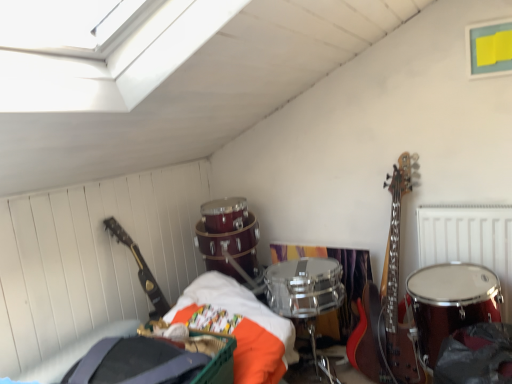
Image resolution: width=512 pixels, height=384 pixels. Find the location of `metallic silver radiator at upper right`. metallic silver radiator at upper right is located at coordinates (469, 240).

Is metallic silver radiator at upper right positioned with its back to glossy black guitar at left?

No, metallic silver radiator at upper right is not facing away from glossy black guitar at left.

Locate an element on the screen. guitar located above the metallic silver radiator at upper right (from a real-world perspective) is located at coordinates (140, 270).

In the scene shown: Can you confirm if metallic silver radiator at upper right is shorter than glossy black guitar at left?

Correct, metallic silver radiator at upper right is not as tall as glossy black guitar at left.

How many degrees apart are the facing directions of shiny red drum at right and glossy black guitar at left?

The angle between the facing direction of shiny red drum at right and the facing direction of glossy black guitar at left is 87.6 degrees.

Looking at their sizes, would you say shiny red drum at right is wider or thinner than glossy black guitar at left?

In the image, shiny red drum at right appears to be wider than glossy black guitar at left.

Considering the sizes of objects shiny red drum at right and glossy black guitar at left in the image provided, who is bigger, shiny red drum at right or glossy black guitar at left?

Bigger between the two is shiny red drum at right.

From the image's perspective, which is below, shiny red drum at right or glossy black guitar at left?

shiny red drum at right is shown below in the image.

From a real-world perspective, is shiny red drum at right on top of metallic silver radiator at upper right?

No, from a real-world perspective, shiny red drum at right is not above metallic silver radiator at upper right.

Based on the photo, from their relative heights in the image, would you say shiny red drum at right is taller or shorter than metallic silver radiator at upper right?

Clearly, shiny red drum at right is shorter compared to metallic silver radiator at upper right.

Based on their sizes in the image, would you say shiny red drum at right is bigger or smaller than metallic silver radiator at upper right?

Clearly, shiny red drum at right is larger in size than metallic silver radiator at upper right.

Is shiny red drum at right completely or partially outside of metallic silver radiator at upper right?

Absolutely, shiny red drum at right is external to metallic silver radiator at upper right.

Between metallic silver radiator at upper right and shiny red drum at right, which one has less height?

shiny red drum at right is shorter.

Does metallic silver radiator at upper right have a greater width compared to shiny red drum at right?

In fact, metallic silver radiator at upper right might be narrower than shiny red drum at right.

Between metallic silver radiator at upper right and shiny red drum at right, which one appears on the right side from the viewer's perspective?

Positioned to the right is metallic silver radiator at upper right.

From the image's perspective, who appears lower, metallic silver radiator at upper right or shiny red drum at right?

From the image's view, shiny red drum at right is below.

Is glossy black guitar at left facing towards shiny red drum at right?

No, glossy black guitar at left does not turn towards shiny red drum at right.

Considering the positions of objects glossy black guitar at left and shiny red drum at right in the image provided, who is more to the left, glossy black guitar at left or shiny red drum at right?

Positioned to the left is glossy black guitar at left.

Is glossy black guitar at left far away from shiny red drum at right?

Yes, glossy black guitar at left and shiny red drum at right are quite far apart.

Which of these two, glossy black guitar at left or shiny red drum at right, is wider?

With larger width is shiny red drum at right.

Between glossy black guitar at left and metallic silver radiator at upper right, which one appears on the right side from the viewer's perspective?

From the viewer's perspective, metallic silver radiator at upper right appears more on the right side.

Is glossy black guitar at left bigger or smaller than metallic silver radiator at upper right?

glossy black guitar at left is smaller than metallic silver radiator at upper right.

Does glossy black guitar at left contain metallic silver radiator at upper right?

No, metallic silver radiator at upper right is not inside glossy black guitar at left.

From the image's perspective, which one is positioned higher, glossy black guitar at left or metallic silver radiator at upper right?

metallic silver radiator at upper right is shown above in the image.

Locate an element on the screen. guitar located below the metallic silver radiator at upper right (from the image's perspective) is located at coordinates (140, 270).

Identify the location of drum in front of the glossy black guitar at left. The height and width of the screenshot is (384, 512). (451, 302).

Estimate the real-world distances between objects in this image. Which object is closer to shiny red drum at right, glossy black guitar at left or metallic silver radiator at upper right?

metallic silver radiator at upper right.

Consider the image. Estimate the real-world distances between objects in this image. Which object is closer to shiny red drum at right, metallic silver radiator at upper right or glossy black guitar at left?

Among the two, metallic silver radiator at upper right is located nearer to shiny red drum at right.

Which object lies further to the anchor point metallic silver radiator at upper right, glossy black guitar at left or shiny red drum at right?

Among the two, glossy black guitar at left is located further to metallic silver radiator at upper right.

Looking at the image, which one is located closer to metallic silver radiator at upper right, shiny red drum at right or glossy black guitar at left?

shiny red drum at right is closer to metallic silver radiator at upper right.

When comparing their distances from glossy black guitar at left, does shiny red drum at right or metallic silver radiator at upper right seem further?

metallic silver radiator at upper right is positioned further to the anchor glossy black guitar at left.

Considering their positions, is metallic silver radiator at upper right positioned closer to glossy black guitar at left than shiny red drum at right?

Among the two, shiny red drum at right is located nearer to glossy black guitar at left.

Identify the location of drum between glossy black guitar at left and metallic silver radiator at upper right in the horizontal direction. (451, 302).